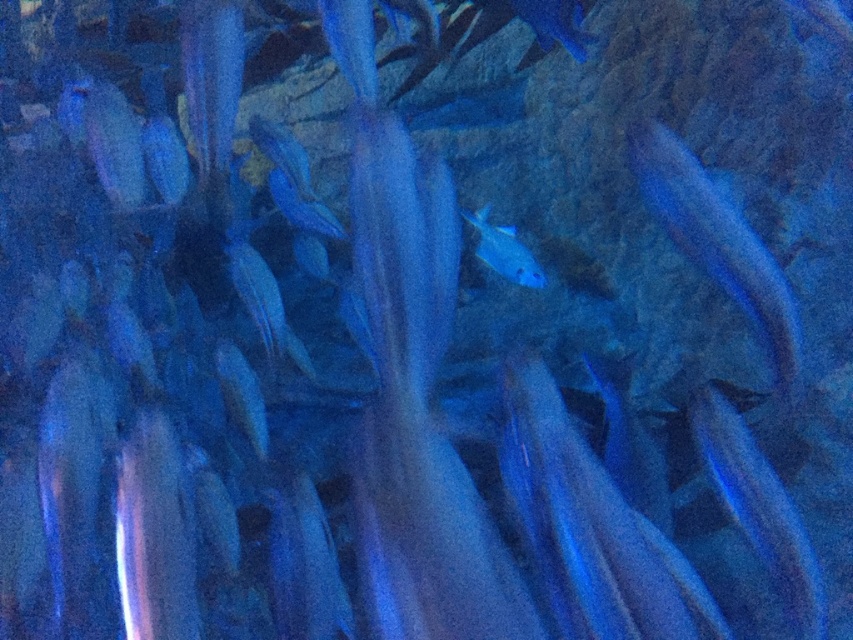
Is point (792, 352) positioned in front of point (483, 212)?

Yes, it is in front of point (483, 212).

Looking at this image, does glossy blue fish at right lie behind glossy blue fish at center?

No, it is not.

Locate an element on the screen. This screenshot has height=640, width=853. glossy blue fish at right is located at coordinates (718, 243).